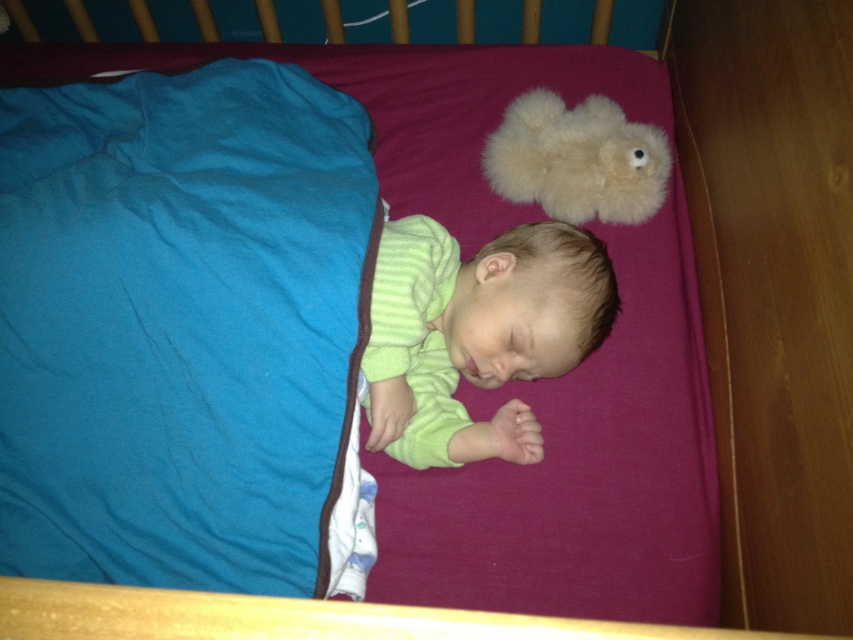
Does teal soft fabric at lower left have a greater height compared to green soft baby at center?

Yes.

Between teal soft fabric at lower left and green soft baby at center, which one is positioned lower?

green soft baby at center is below.

This screenshot has height=640, width=853. I want to click on teal soft fabric at lower left, so click(180, 324).

The width and height of the screenshot is (853, 640). I want to click on teal soft fabric at lower left, so click(180, 324).

Which of these two, green soft baby at center or fluffy beige teddy bear at upper center, stands shorter?

Standing shorter between the two is fluffy beige teddy bear at upper center.

The image size is (853, 640). I want to click on green soft baby at center, so pos(476,333).

Between point (442, 230) and point (601, 179), which one is positioned in front?

Positioned in front is point (442, 230).

This screenshot has width=853, height=640. I want to click on green soft baby at center, so click(x=476, y=333).

Is teal soft fabric at lower left below fluffy beige teddy bear at upper center?

Correct, teal soft fabric at lower left is located below fluffy beige teddy bear at upper center.

Where is `teal soft fabric at lower left`? teal soft fabric at lower left is located at coordinates pyautogui.click(x=180, y=324).

You are a GUI agent. You are given a task and a screenshot of the screen. Output one action in this format:
    pyautogui.click(x=<x>, y=<y>)
    Task: Click on the teal soft fabric at lower left
    The height and width of the screenshot is (640, 853).
    Given the screenshot: What is the action you would take?
    pyautogui.click(x=180, y=324)